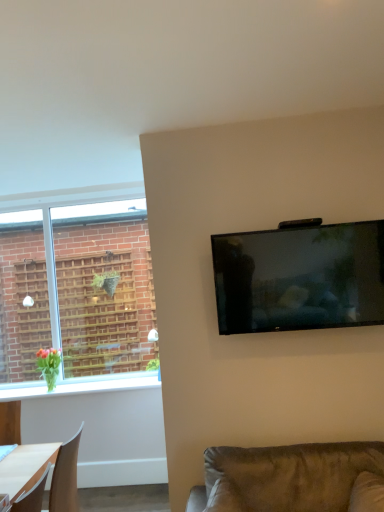
Question: Would you say white glossy window sill at lower left is inside or outside suede-like brown couch at lower right?

Choices:
 (A) inside
 (B) outside

Answer: (B)

Question: Is white glossy window sill at lower left in front of or behind suede-like brown couch at lower right in the image?

Choices:
 (A) behind
 (B) front

Answer: (A)

Question: Which object is the closest to the matte black tv at upper right?

Choices:
 (A) white glossy window sill at lower left
 (B) suede-like brown couch at lower right

Answer: (B)

Question: Which is nearer to the white glossy window sill at lower left?

Choices:
 (A) matte black tv at upper right
 (B) suede-like brown couch at lower right

Answer: (B)